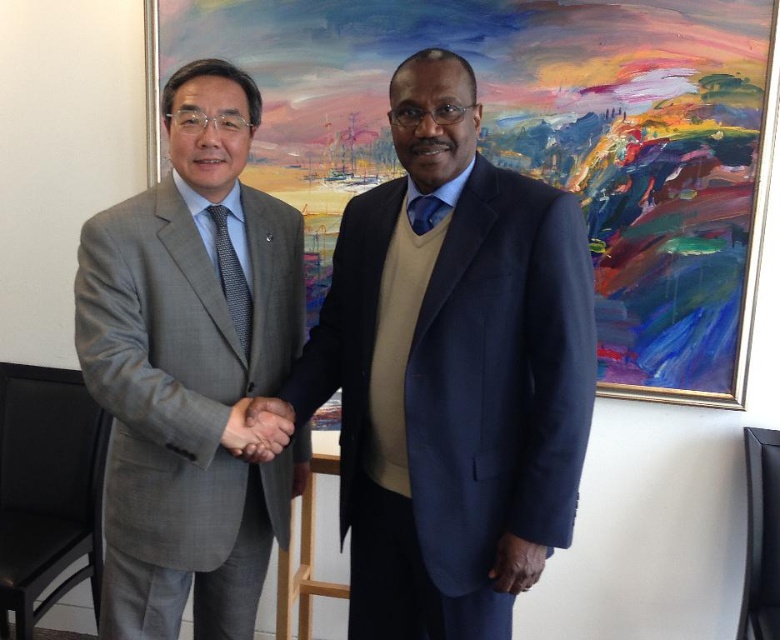
How much distance is there between matte blue suit at center and dark gray textured tie at center?

matte blue suit at center and dark gray textured tie at center are 40.97 centimeters apart from each other.

Who is taller, matte blue suit at center or dark gray textured tie at center?

Standing taller between the two is matte blue suit at center.

Locate an element on the screen. Image resolution: width=780 pixels, height=640 pixels. matte blue suit at center is located at coordinates (451, 369).

Between point (225, 563) and point (516, 570), which one is positioned in front?

Point (516, 570)

Does gray wool suit at left appear on the right side of dark brown leather hand at center?

Incorrect, gray wool suit at left is not on the right side of dark brown leather hand at center.

Does point (168, 611) lie in front of point (513, 577)?

No, it is not.

What are the coordinates of `gray wool suit at left` in the screenshot? It's located at pyautogui.click(x=190, y=369).

Who is higher up, oil painting at upper center or dark brown leather hand at center?

Positioned higher is oil painting at upper center.

Does point (718, 44) lie behind point (536, 579)?

Yes, point (718, 44) is behind point (536, 579).

The image size is (780, 640). Find the location of `oil painting at upper center`. oil painting at upper center is located at coordinates (537, 144).

Locate an element on the screen. The image size is (780, 640). oil painting at upper center is located at coordinates (537, 144).